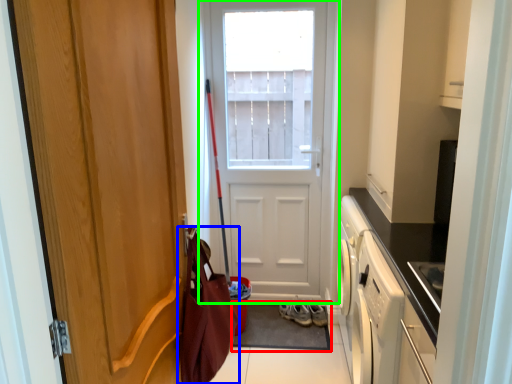
Question: Which object is positioned farthest from doormat (highlighted by a red box)? Select from messenger bag (highlighted by a blue box) and door (highlighted by a green box).

Choices:
 (A) messenger bag
 (B) door

Answer: (A)